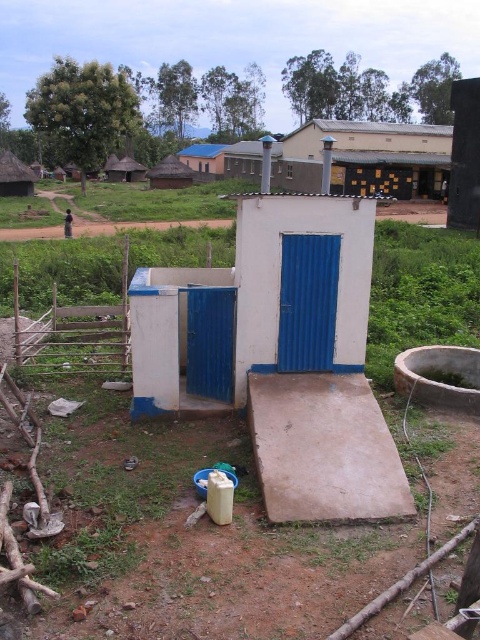
Who is positioned more to the right, blue corrugated metal hut at center or thatched straw hut at upper left?

blue corrugated metal hut at center is more to the right.

Between blue corrugated metal hut at center and thatched straw hut at upper left, which one has less height?

thatched straw hut at upper left

Is point (188, 163) in front of point (137, 172)?

No, it is behind (137, 172).

Identify the location of blue corrugated metal hut at center. (204, 157).

Is point (433, 173) less distant than point (204, 173)?

Yes, point (433, 173) is closer to viewer.

Is dark brown wooden hut at upper center below blue corrugated metal hut at center?

Yes, dark brown wooden hut at upper center is below blue corrugated metal hut at center.

Between point (374, 132) and point (214, 144), which one is positioned in front?

Positioned in front is point (374, 132).

Find the location of a particular element. The width and height of the screenshot is (480, 640). dark brown wooden hut at upper center is located at coordinates (369, 157).

The image size is (480, 640). Describe the element at coordinates (14, 177) in the screenshot. I see `thatched straw hut at left` at that location.

Which of these two, thatched straw hut at left or blue corrugated metal hut at center, stands shorter?

thatched straw hut at left

Does point (7, 156) come closer to viewer compared to point (213, 172)?

Yes, it is in front of point (213, 172).

Find the location of `thatched straw hut at left`. thatched straw hut at left is located at coordinates (14, 177).